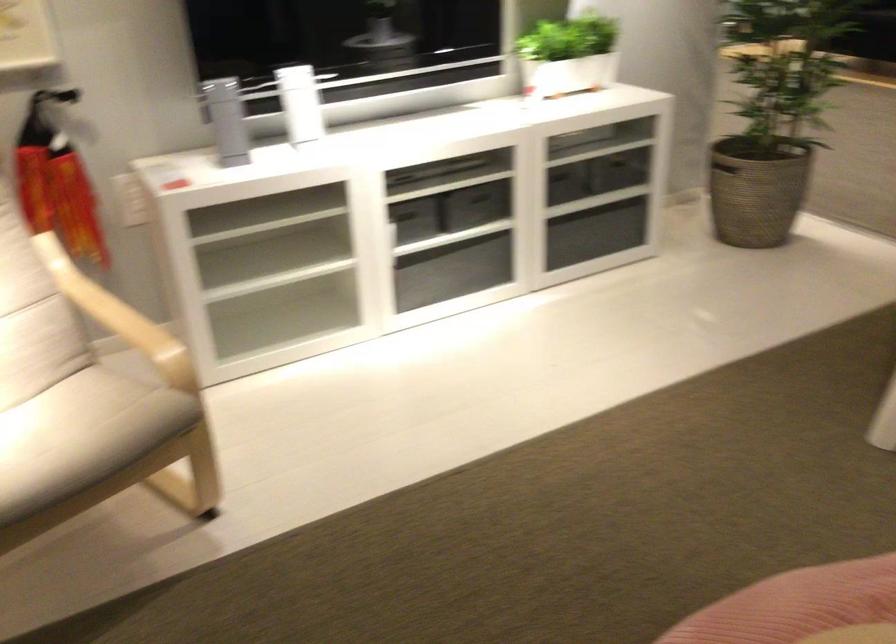
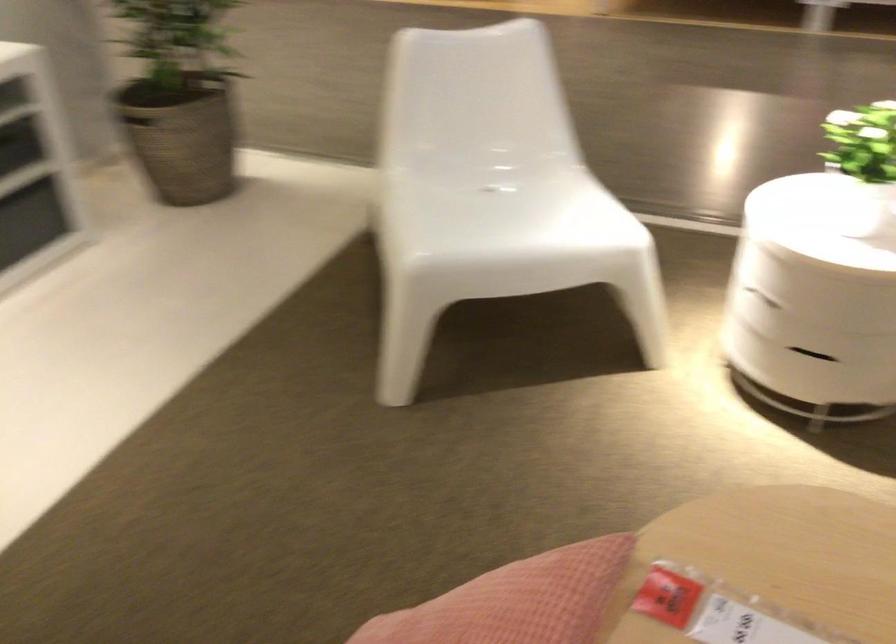
Question: The camera is either moving clockwise (left) or counter-clockwise (right) around the object. The first image is from the beginning of the video and the second image is from the end. Is the camera moving left or right when shooting the video?

Choices:
 (A) Left
 (B) Right

Answer: (A)